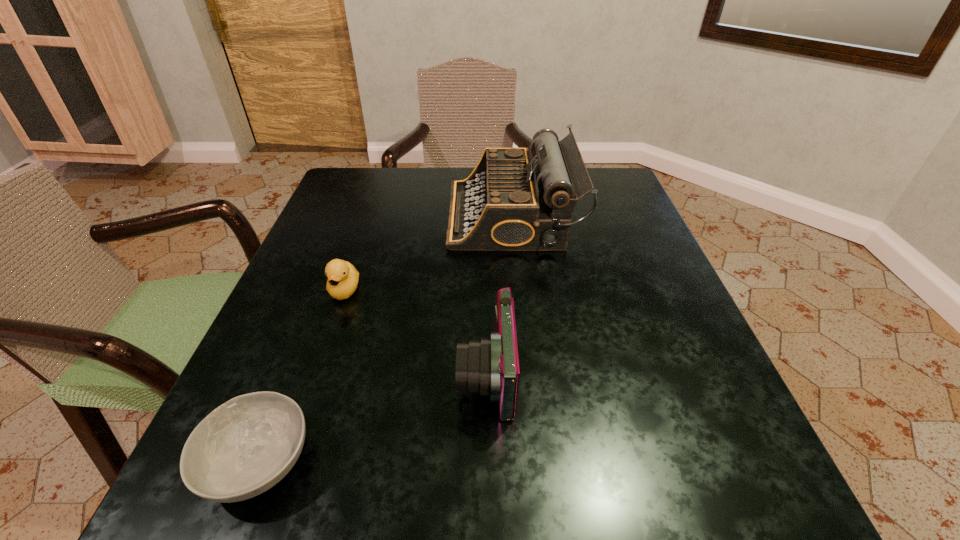
Image resolution: width=960 pixels, height=540 pixels. I want to click on vacant space situated 0.270m on the front-facing side of the third shortest object, so click(283, 374).

Where is `vacant space located 0.250m on the front-facing side of the third shortest object`? The width and height of the screenshot is (960, 540). vacant space located 0.250m on the front-facing side of the third shortest object is located at coordinates (297, 374).

Locate an element on the screen. vacant space located 0.310m facing forward on the second shortest object is located at coordinates (281, 479).

Where is `vacant space situated on the right of the shortest object`? The image size is (960, 540). vacant space situated on the right of the shortest object is located at coordinates (474, 462).

This screenshot has width=960, height=540. In order to click on object positioned at the far edge in this screenshot , I will do `click(510, 202)`.

Locate an element on the screen. object at the near edge is located at coordinates (247, 445).

The width and height of the screenshot is (960, 540). I want to click on duckling present at the left edge, so click(342, 282).

The image size is (960, 540). Identify the location of bowl situated at the left edge. (247, 445).

Locate an element on the screen. The image size is (960, 540). object present at the right edge is located at coordinates (510, 202).

Where is `object that is at the near left corner`? This screenshot has width=960, height=540. object that is at the near left corner is located at coordinates pos(247,445).